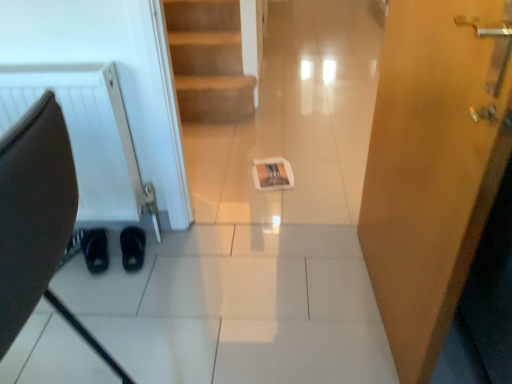
Locate an element on the screen. This screenshot has height=384, width=512. free space in front of white textured radiator at left is located at coordinates (89, 300).